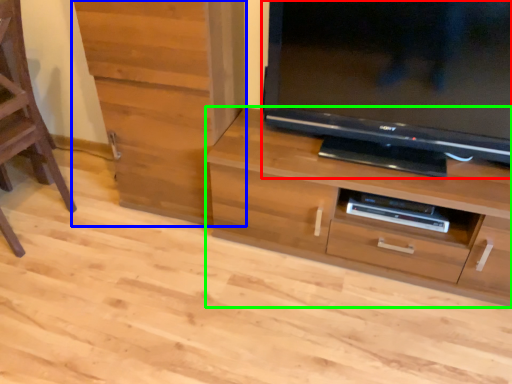
Question: Which object is the farthest from television (highlighted by a red box)? Choose among these: cabinetry (highlighted by a blue box) or chest of drawers (highlighted by a green box).

Choices:
 (A) cabinetry
 (B) chest of drawers

Answer: (A)